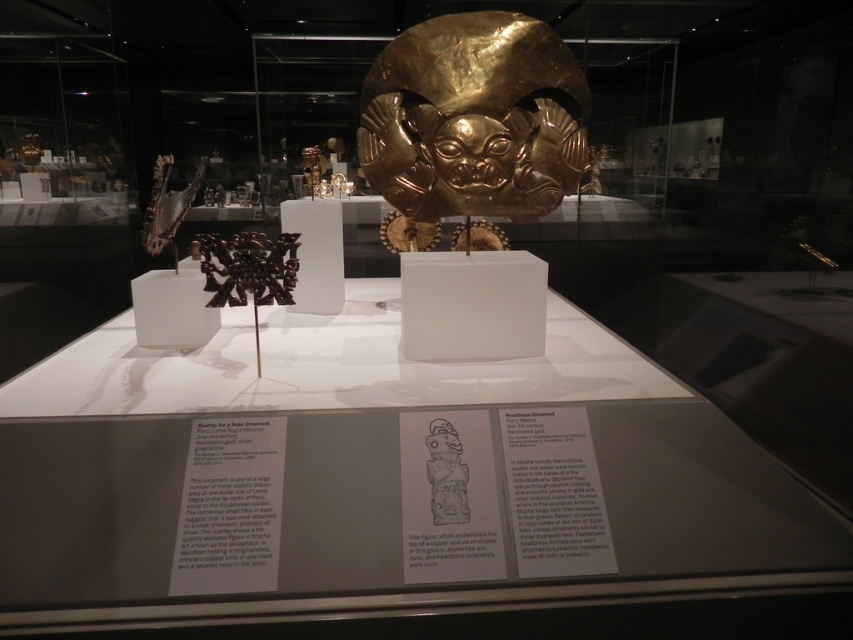
Question: Which point is closer to the camera?

Choices:
 (A) (437, 460)
 (B) (567, 122)

Answer: (A)

Question: Observing the image, what is the correct spatial positioning of gold shiny mask at center in reference to matte gold mask at center?

Choices:
 (A) above
 (B) below

Answer: (A)

Question: Does gold shiny mask at center have a lesser width compared to matte gold mask at center?

Choices:
 (A) yes
 (B) no

Answer: (B)

Question: Does gold shiny mask at center have a lesser width compared to matte gold mask at center?

Choices:
 (A) no
 (B) yes

Answer: (A)

Question: Which point is farther to the camera?

Choices:
 (A) gold shiny mask at center
 (B) matte gold mask at center

Answer: (A)